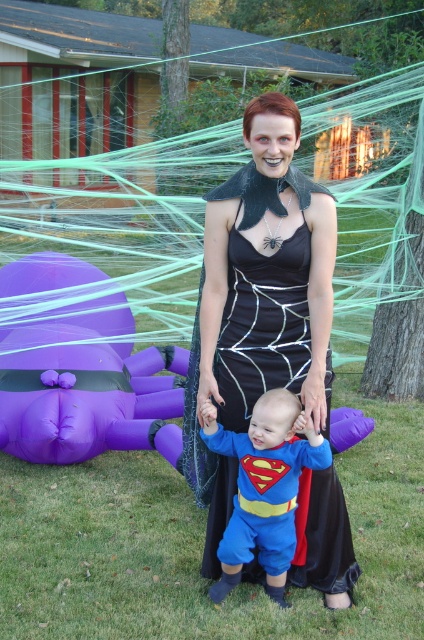
Can you confirm if black matte dress at center is positioned to the right of purple inflatable spider at lower left?

Indeed, black matte dress at center is positioned on the right side of purple inflatable spider at lower left.

Who is lower down, black matte dress at center or purple inflatable spider at lower left?

purple inflatable spider at lower left is lower down.

Between point (309, 570) and point (136, 401), which one is positioned behind?

Positioned behind is point (136, 401).

Identify the location of black matte dress at center. This screenshot has width=424, height=640. (259, 301).

Can you confirm if black matte dress at center is bigger than blue fabric superman costume at center?

Yes.

I want to click on black matte dress at center, so click(x=259, y=301).

Is point (226, 236) in front of point (253, 429)?

That is False.

At what (x,y) coordinates should I click in order to perform the action: click on black matte dress at center. Please return your answer as a coordinate pair (x, y). The width and height of the screenshot is (424, 640). Looking at the image, I should click on (259, 301).

Between purple inflatable spider at lower left and blue fabric superman costume at center, which one appears on the right side from the viewer's perspective?

blue fabric superman costume at center

Based on the photo, is purple inflatable spider at lower left further to the viewer compared to blue fabric superman costume at center?

Yes.

Which is in front, point (28, 420) or point (251, 483)?

Point (251, 483) is in front.

Locate an element on the screen. This screenshot has width=424, height=640. purple inflatable spider at lower left is located at coordinates (80, 368).